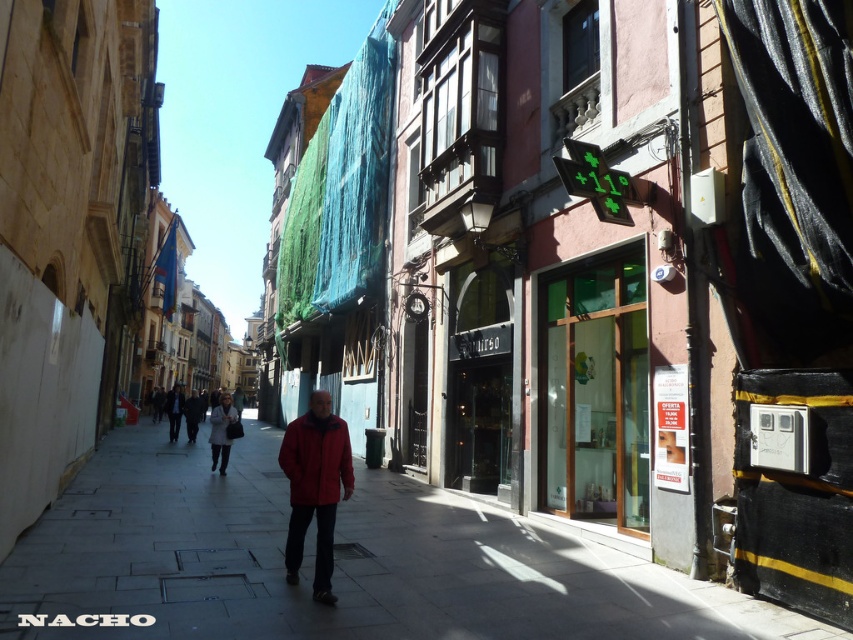
Question: Which of the following is the closest to the observer?

Choices:
 (A) (170, 422)
 (B) (328, 467)
 (C) (225, 448)

Answer: (B)

Question: Considering the relative positions of light gray wool coat at center and matte black jacket at center in the image provided, where is light gray wool coat at center located with respect to matte black jacket at center?

Choices:
 (A) above
 (B) below

Answer: (B)

Question: Which point is farther from the camera taking this photo?

Choices:
 (A) (289, 449)
 (B) (229, 416)

Answer: (B)

Question: Is matte red jacket at center thinner than dark gray jacket at center?

Choices:
 (A) yes
 (B) no

Answer: (A)

Question: Does matte red jacket at center appear on the right side of matte black jacket at center?

Choices:
 (A) yes
 (B) no

Answer: (A)

Question: Which of the following is the farthest from the observer?

Choices:
 (A) (177, 404)
 (B) (352, 531)

Answer: (A)